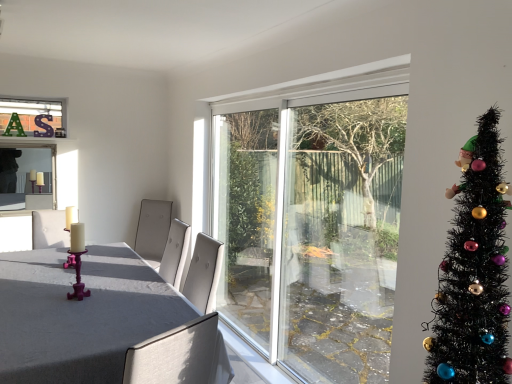
Question: Considering the relative sizes of black artificial christmas tree at right and white glossy candle at left in the image provided, is black artificial christmas tree at right smaller than white glossy candle at left?

Choices:
 (A) yes
 (B) no

Answer: (B)

Question: Is black artificial christmas tree at right thinner than white glossy candle at left?

Choices:
 (A) yes
 (B) no

Answer: (B)

Question: From the image's perspective, does black artificial christmas tree at right appear higher than white glossy candle at left?

Choices:
 (A) yes
 (B) no

Answer: (A)

Question: Is black artificial christmas tree at right directly adjacent to white glossy candle at left?

Choices:
 (A) yes
 (B) no

Answer: (B)

Question: Is black artificial christmas tree at right taller than white glossy candle at left?

Choices:
 (A) no
 (B) yes

Answer: (B)

Question: From a real-world perspective, is white glossy candle at left positioned above or below purple metallic candle holder at left?

Choices:
 (A) above
 (B) below

Answer: (B)

Question: Is white glossy candle at left inside or outside of purple metallic candle holder at left?

Choices:
 (A) inside
 (B) outside

Answer: (B)

Question: In the image, is white glossy candle at left positioned in front of or behind purple metallic candle holder at left?

Choices:
 (A) front
 (B) behind

Answer: (B)

Question: Looking at the image, does white glossy candle at left seem bigger or smaller compared to purple metallic candle holder at left?

Choices:
 (A) big
 (B) small

Answer: (B)

Question: Do you think matte gray table at center is within black artificial christmas tree at right, or outside of it?

Choices:
 (A) outside
 (B) inside

Answer: (A)

Question: In the image, is matte gray table at center positioned in front of or behind black artificial christmas tree at right?

Choices:
 (A) behind
 (B) front

Answer: (A)

Question: Considering the relative positions of matte gray table at center and black artificial christmas tree at right in the image provided, is matte gray table at center to the left or to the right of black artificial christmas tree at right?

Choices:
 (A) right
 (B) left

Answer: (B)

Question: From a real-world perspective, is matte gray table at center above or below black artificial christmas tree at right?

Choices:
 (A) below
 (B) above

Answer: (A)

Question: Considering the positions of black artificial christmas tree at right and matte glass candlesticks at left in the image, is black artificial christmas tree at right wider or thinner than matte glass candlesticks at left?

Choices:
 (A) thin
 (B) wide

Answer: (B)

Question: Relative to matte glass candlesticks at left, is black artificial christmas tree at right in front or behind?

Choices:
 (A) front
 (B) behind

Answer: (A)